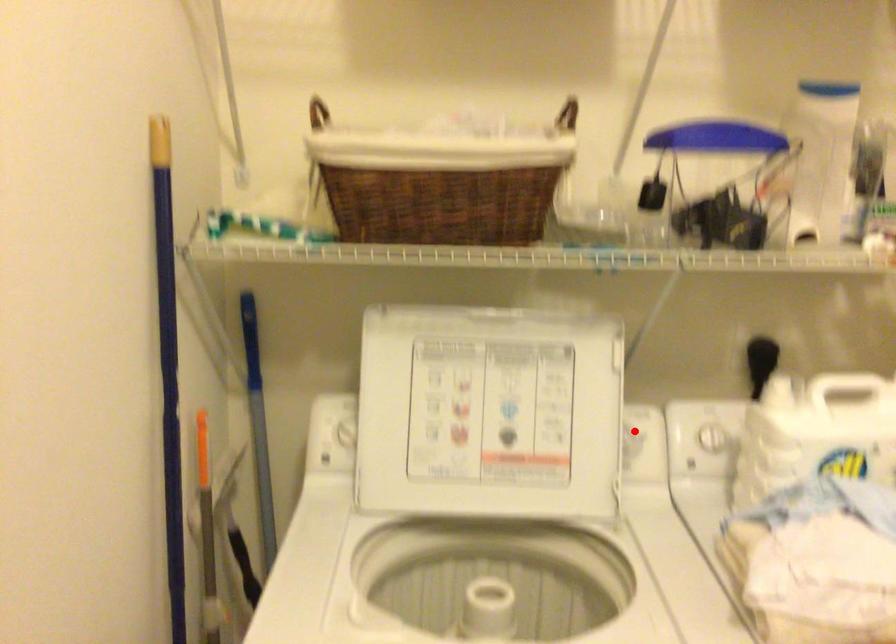
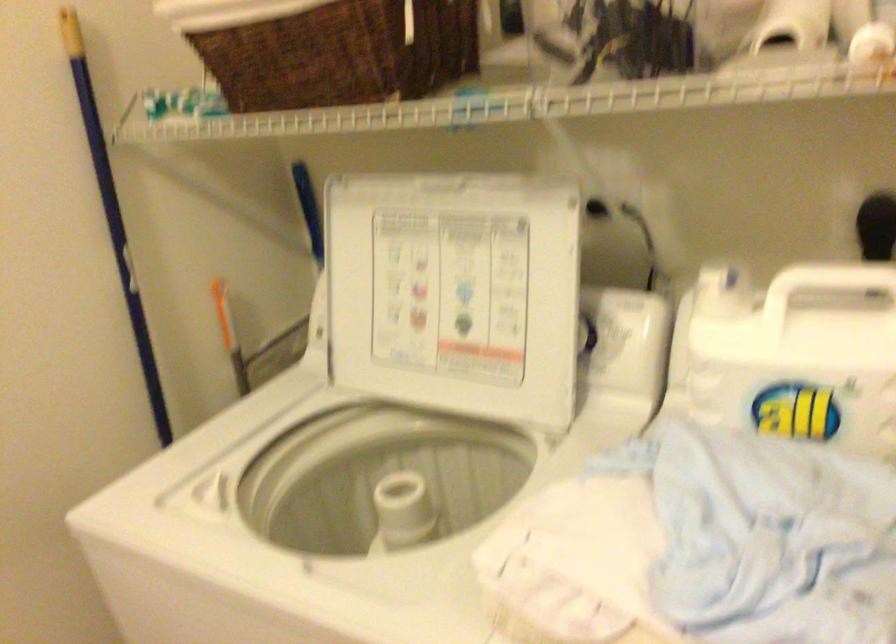
Question: I am providing you with two images of the same scene from different viewpoints. A red point is marked on the first image. Can you still see the location of the red point in image 2?

Choices:
 (A) Yes
 (B) No

Answer: (A)